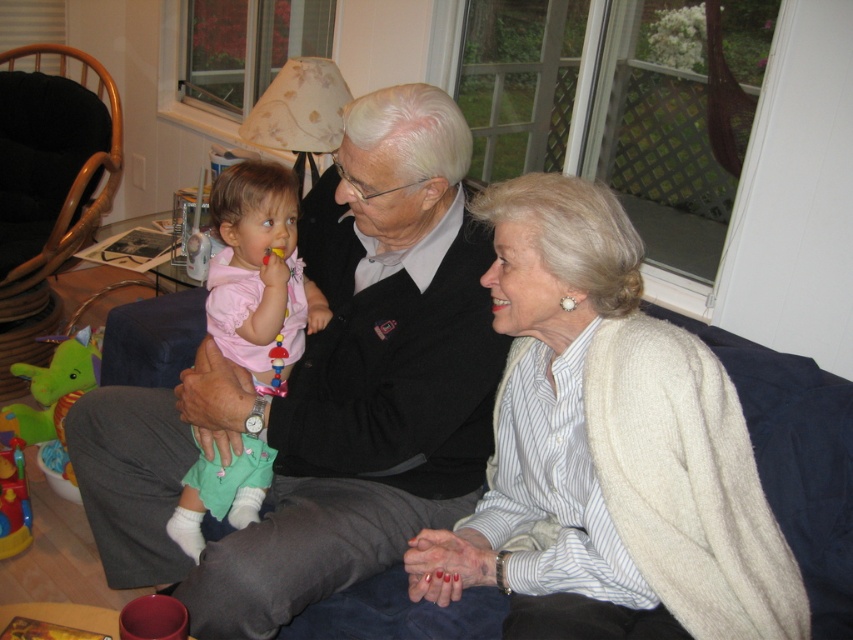
Question: Among these objects, which one is nearest to the camera?

Choices:
 (A) green plush dinosaur at left
 (B) brown woven armchair at left
 (C) matte black sweater at center
 (D) pink fabric baby at left

Answer: (C)

Question: Is brown woven armchair at left closer to camera compared to green plush dinosaur at left?

Choices:
 (A) yes
 (B) no

Answer: (B)

Question: Which is nearer to the matte black sweater at center?

Choices:
 (A) pink fabric baby at left
 (B) white textured sweater at center
 (C) plastic/smooth toy at center
 (D) brown woven armchair at left

Answer: (A)

Question: In this image, where is white textured sweater at center located relative to pink fabric baby at left?

Choices:
 (A) right
 (B) left

Answer: (A)

Question: Among these points, which one is farthest from the camera?

Choices:
 (A) (236, 304)
 (B) (93, 227)
 (C) (608, 531)
 (D) (122, 497)

Answer: (B)

Question: Does pink fabric baby at left appear on the right side of plastic/smooth toy at center?

Choices:
 (A) yes
 (B) no

Answer: (B)